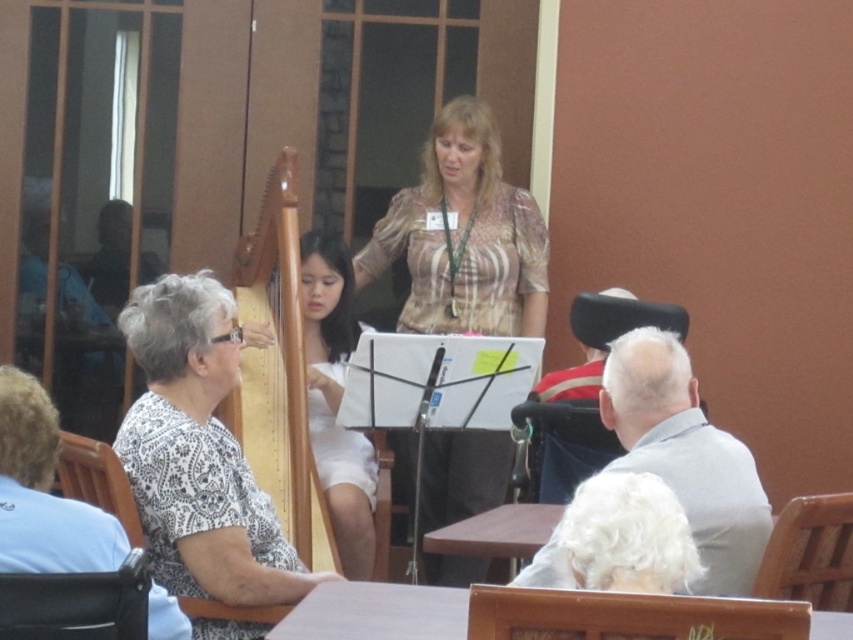
Measure the distance from white dotted shirt at left to patterned fabric blouse at center.

white dotted shirt at left is 2.41 meters away from patterned fabric blouse at center.

Between point (236, 465) and point (447, 305), which one is positioned in front?

Point (236, 465) is in front.

Does point (219, 387) come closer to viewer compared to point (408, 240)?

Yes, it is.

Where is `white dotted shirt at left`? white dotted shirt at left is located at coordinates (198, 452).

Can you confirm if white dotted shirt at left is positioned to the left of white fabric dress at center?

Correct, you'll find white dotted shirt at left to the left of white fabric dress at center.

Who is more distant from viewer, (160,497) or (337,499)?

Point (337,499)

Where is `white dotted shirt at left`? The height and width of the screenshot is (640, 853). white dotted shirt at left is located at coordinates (198, 452).

Which is more to the right, patterned fabric blouse at center or white fabric dress at center?

Positioned to the right is patterned fabric blouse at center.

Is patterned fabric blouse at center bigger than white fabric dress at center?

No.

What do you see at coordinates (463, 236) in the screenshot? The image size is (853, 640). I see `patterned fabric blouse at center` at bounding box center [463, 236].

Locate an element on the screen. The width and height of the screenshot is (853, 640). patterned fabric blouse at center is located at coordinates (463, 236).